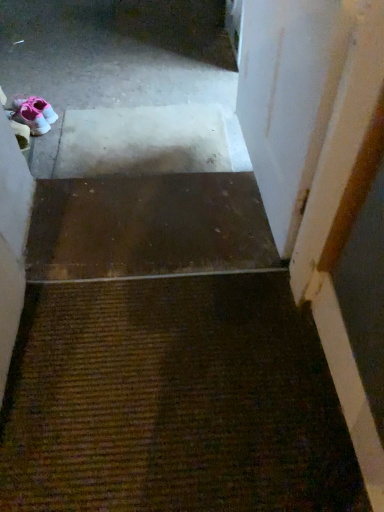
Question: Based on their positions, is brown textured mat at center located to the left or right of brown matte stair at center?

Choices:
 (A) right
 (B) left

Answer: (A)

Question: Is brown textured mat at center inside or outside of brown matte stair at center?

Choices:
 (A) inside
 (B) outside

Answer: (B)

Question: Which is nearer to the pink fabric sneakers at upper left?

Choices:
 (A) white matte door at upper right
 (B) brown textured mat at center
 (C) brown matte stair at center

Answer: (C)

Question: Based on their relative distances, which object is nearer to the white matte door at upper right?

Choices:
 (A) brown matte stair at center
 (B) pink fabric sneakers at upper left
 (C) brown textured mat at center

Answer: (A)